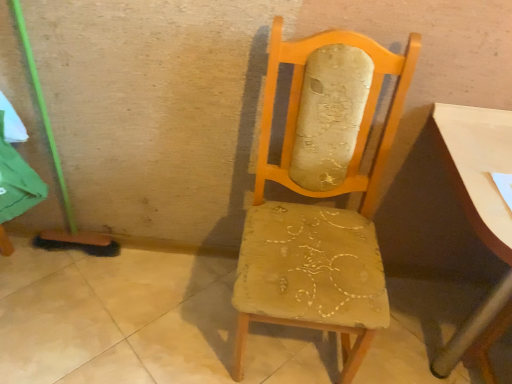
Locate an element on the screen. The height and width of the screenshot is (384, 512). free space below smooth white table at right (from a real-world perspective) is located at coordinates pyautogui.click(x=428, y=331).